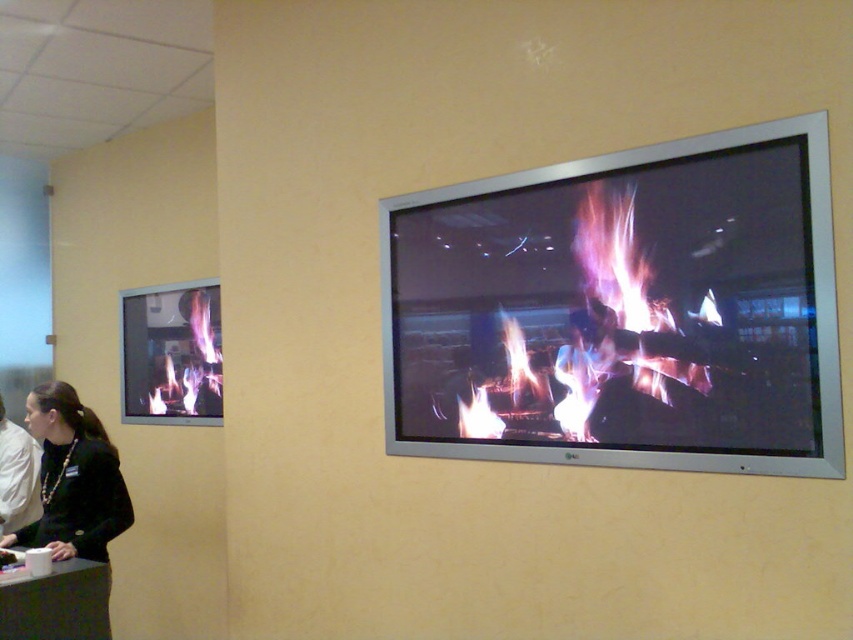
Question: Can you confirm if black fabric jacket at lower left is positioned to the left of matte black fireplace at left?

Choices:
 (A) no
 (B) yes

Answer: (B)

Question: Which of the following is the farthest from the observer?

Choices:
 (A) (61, 449)
 (B) (169, 394)
 (C) (662, 193)

Answer: (B)

Question: Can you confirm if metallic silver screen at upper right is bigger than matte black fireplace at left?

Choices:
 (A) yes
 (B) no

Answer: (A)

Question: Among these points, which one is nearest to the camera?

Choices:
 (A) (740, 259)
 (B) (144, 369)
 (C) (94, 538)

Answer: (A)

Question: Is the position of metallic silver screen at upper right less distant than that of black fabric jacket at lower left?

Choices:
 (A) yes
 (B) no

Answer: (A)

Question: Based on their relative distances, which object is farther from the black fabric jacket at lower left?

Choices:
 (A) matte black fireplace at left
 (B) metallic silver screen at upper right

Answer: (B)